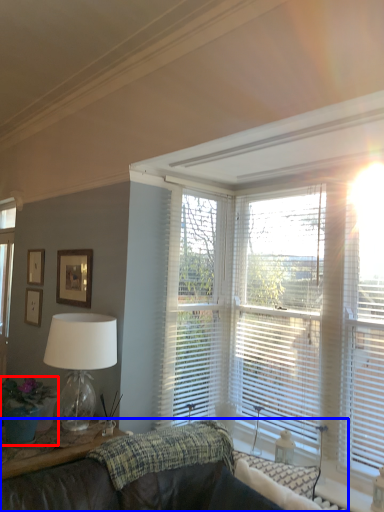
Question: Which object is closer to the camera taking this photo, houseplant (highlighted by a red box) or studio couch (highlighted by a blue box)?

Choices:
 (A) houseplant
 (B) studio couch

Answer: (B)